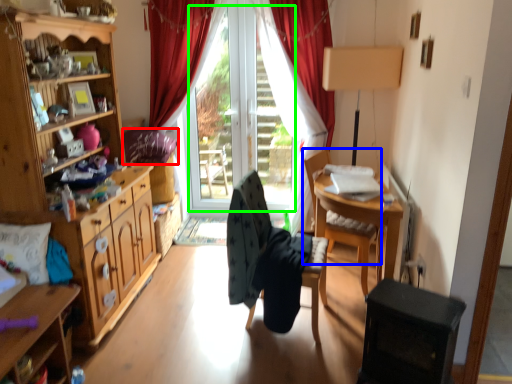
Question: Which object is positioned farthest from pillow (highlighted by a red box)? Select from chair (highlighted by a blue box) and window screen (highlighted by a green box).

Choices:
 (A) chair
 (B) window screen

Answer: (A)